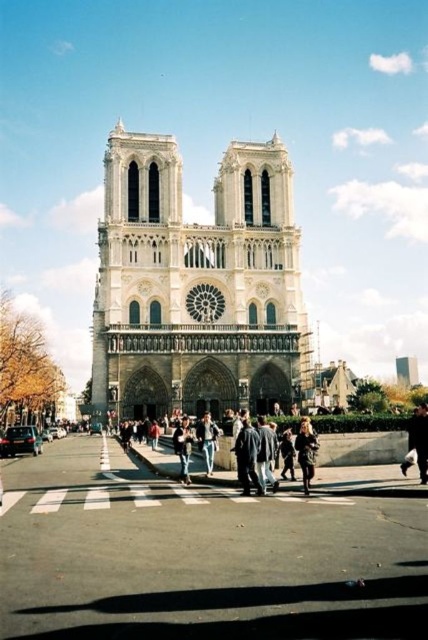
Question: Which object is positioned farthest from the white stone church at center?

Choices:
 (A) dark brown leather jacket at center
 (B) shiny black sedan at lower left
 (C) denim jacket at center
 (D) smooth asphalt plaza at center

Answer: (B)

Question: Which point is closer to the camera?

Choices:
 (A) (181, 442)
 (B) (14, 442)
 (C) (300, 465)

Answer: (A)

Question: Does shiny black sedan at lower left appear on the left side of denim pants at center?

Choices:
 (A) yes
 (B) no

Answer: (A)

Question: Is white stone church at center smaller than denim pants at center?

Choices:
 (A) yes
 (B) no

Answer: (B)

Question: Is white stone church at center bigger than dark brown leather jacket at lower right?

Choices:
 (A) no
 (B) yes

Answer: (B)

Question: Which point is farther to the camera?

Choices:
 (A) shiny black sedan at lower left
 (B) dark brown leather jacket at lower right

Answer: (A)